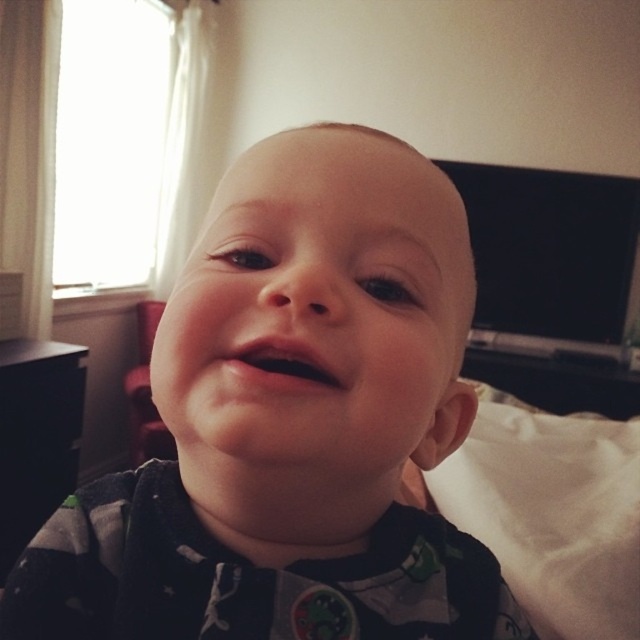
Based on the photo, can you confirm if soft gray fabric at center is wider than white soft pillow at lower right?

Incorrect, soft gray fabric at center's width does not surpass white soft pillow at lower right's.

How far apart are soft gray fabric at center and white soft pillow at lower right?

soft gray fabric at center is 29.90 inches from white soft pillow at lower right.

I want to click on soft gray fabric at center, so click(x=291, y=422).